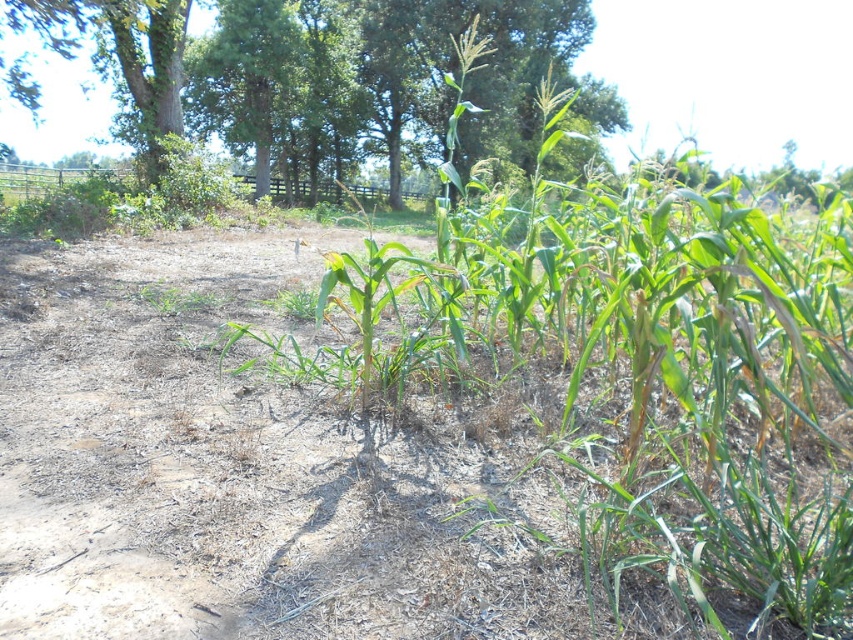
You are a farmer checking the growth of your crops. You notice the green leafy corn at center and the green leafy tree at upper center. Which one has a narrower trunk?

The green leafy corn at center is thinner than the green leafy tree at upper center, so the corn has a narrower trunk.

You are a farmer checking the growth of your crops. You notice the green leafy corn at center and the green leafy tree at upper center. Which one is smaller in size?

The green leafy corn at center is smaller in size compared to the green leafy tree at upper center.